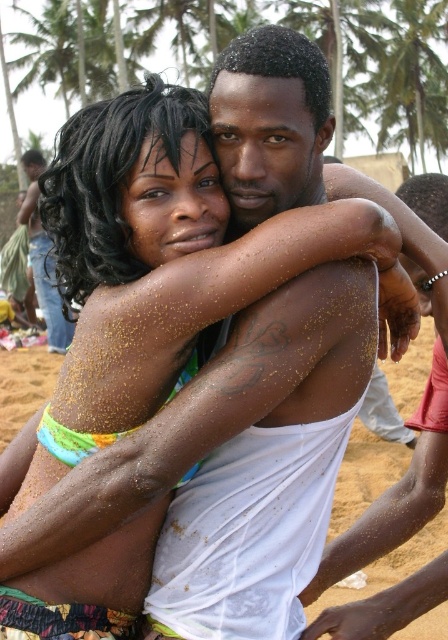
You are a photographer trying to capture a photo of the sandy skin at center and the green leafy palm tree at upper center. Can you position yourself so that the palm tree appears directly above the sandy skin in the photo?

The green leafy palm tree at upper center is already positioned above the sandy skin at center, so yes, you can frame the photo to show the palm tree directly above the sandy skin.

You are a photographer at the beach and want to take a picture of the smooth white shirt at center and the sandy skin at center. Which object is located to the right of the other?

The smooth white shirt at center is positioned on the right side of sandy skin at center.

You are a photographer trying to capture the smooth white shirt at center and the green leafy palm tree at upper center in the same frame. Based on their sizes, which object would appear smaller in the photo?

The smooth white shirt at center would appear smaller in the photo because it is thinner than the green leafy palm tree at upper center.